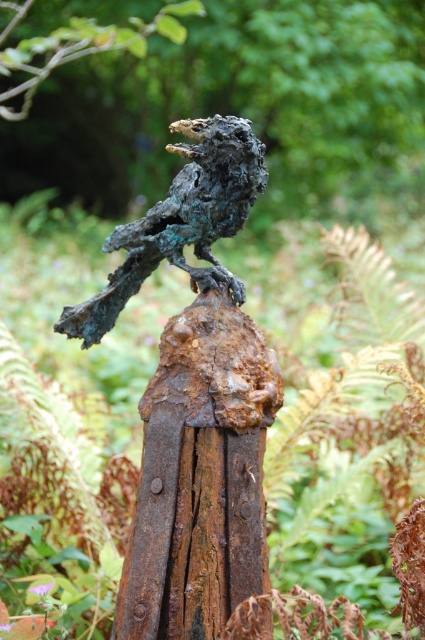
Can you confirm if rusty metal bird at center is taller than green patina bird at center?

Indeed, rusty metal bird at center has a greater height compared to green patina bird at center.

Can you confirm if rusty metal bird at center is positioned above green patina bird at center?

Incorrect, rusty metal bird at center is not positioned above green patina bird at center.

Between point (241, 124) and point (200, 145), which one is positioned behind?

Positioned behind is point (200, 145).

This screenshot has width=425, height=640. I want to click on rusty metal bird at center, so click(195, 400).

Who is taller, rusty metal bird at upper center or rusty metal bird at center?

With more height is rusty metal bird at center.

Can you confirm if rusty metal bird at upper center is bigger than rusty metal bird at center?

Indeed, rusty metal bird at upper center has a larger size compared to rusty metal bird at center.

Does point (78, 8) come behind point (198, 456)?

Yes, point (78, 8) is farther from viewer.

You are a GUI agent. You are given a task and a screenshot of the screen. Output one action in this format:
    pyautogui.click(x=<x>, y=<y>)
    Task: Click on the rusty metal bird at upper center
    The height and width of the screenshot is (640, 425).
    Given the screenshot: What is the action you would take?
    pyautogui.click(x=232, y=102)

Consider the image. Is rusty metal bird at upper center smaller than green patina bird at center?

No, rusty metal bird at upper center is not smaller than green patina bird at center.

Does point (380, 115) lie in front of point (173, 243)?

That is False.

I want to click on rusty metal bird at upper center, so click(232, 102).